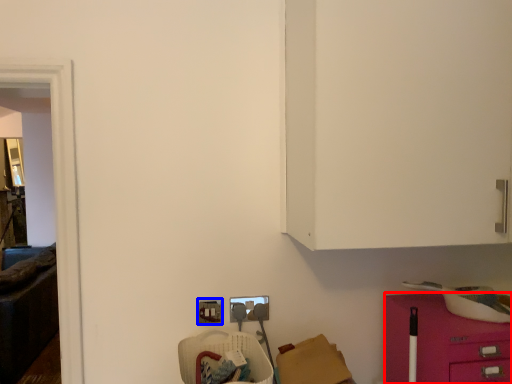
Question: Which object is closer to the camera taking this photo, furniture (highlighted by a red box) or electric outlet (highlighted by a blue box)?

Choices:
 (A) furniture
 (B) electric outlet

Answer: (A)